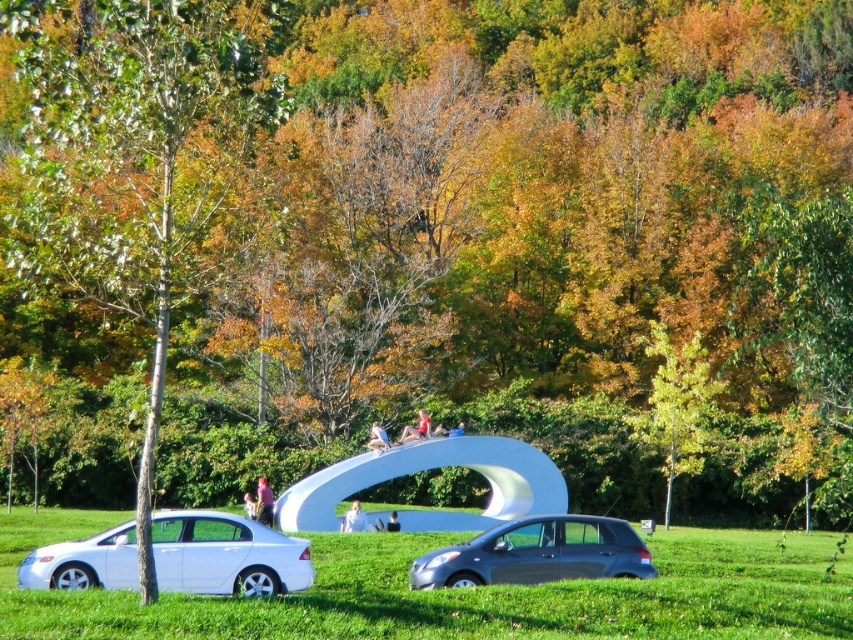
Question: Which object is positioned farthest from the white matte person at center?

Choices:
 (A) light brown leather jacket at center
 (B) matte gray hatchback at center

Answer: (B)

Question: Can you confirm if matte pink shirt at center is thinner than light brown leather jacket at center?

Choices:
 (A) yes
 (B) no

Answer: (A)

Question: Is white matte sedan at lower left further to camera compared to pink fabric shirt at center?

Choices:
 (A) yes
 (B) no

Answer: (B)

Question: Which point is closer to the camera?

Choices:
 (A) 633,422
 (B) 247,513

Answer: (B)

Question: Can you confirm if white smooth sculpture at center is smaller than light brown leather jacket at center?

Choices:
 (A) no
 (B) yes

Answer: (A)

Question: Based on their relative distances, which object is nearer to the green leafy tree at left?

Choices:
 (A) matte pink shirt at center
 (B) blue fabric person at center

Answer: (A)